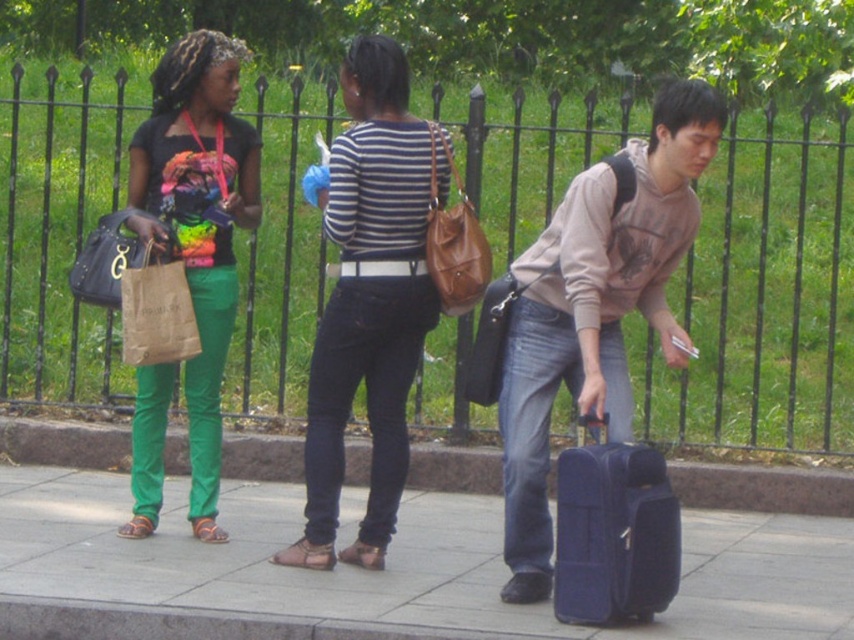
How distant is black metal fence at upper center from matte black shirt at left?

black metal fence at upper center is 6.87 feet from matte black shirt at left.

Who is positioned more to the left, black metal fence at upper center or matte black shirt at left?

From the viewer's perspective, matte black shirt at left appears more on the left side.

Between point (513, 173) and point (168, 112), which one is positioned in front?

Positioned in front is point (168, 112).

Find the location of a particular element. The image size is (854, 640). black metal fence at upper center is located at coordinates tap(765, 296).

Between black metal fence at upper center and smooth concrete pavement at center, which one has less height?

With less height is smooth concrete pavement at center.

Is black metal fence at upper center thinner than smooth concrete pavement at center?

Correct, black metal fence at upper center's width is less than smooth concrete pavement at center's.

In order to click on black metal fence at upper center in this screenshot , I will do `click(765, 296)`.

Identify the location of black metal fence at upper center. This screenshot has width=854, height=640. (765, 296).

The width and height of the screenshot is (854, 640). Describe the element at coordinates (370, 300) in the screenshot. I see `striped cotton shirt at center` at that location.

You are a GUI agent. You are given a task and a screenshot of the screen. Output one action in this format:
    pyautogui.click(x=<x>, y=<y>)
    Task: Click on the striped cotton shirt at center
    Image resolution: width=854 pixels, height=640 pixels.
    Given the screenshot: What is the action you would take?
    pyautogui.click(x=370, y=300)